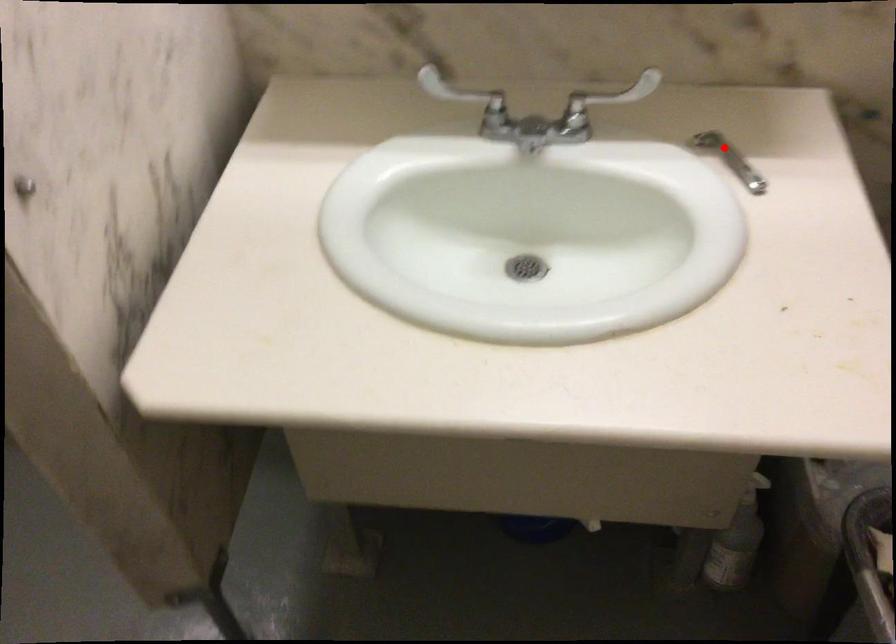
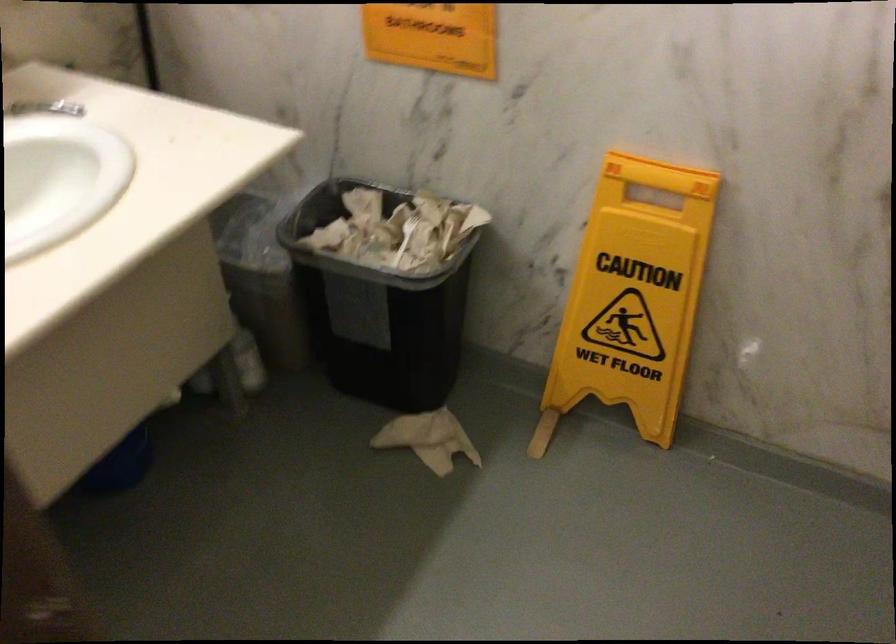
Question: I am providing you with two images of the same scene from different viewpoints. Image1 has a red point marked. In image2, the corresponding 3D location appears at what relative position? Reply with the corresponding letter.

Choices:
 (A) Closer
 (B) Farther

Answer: (B)